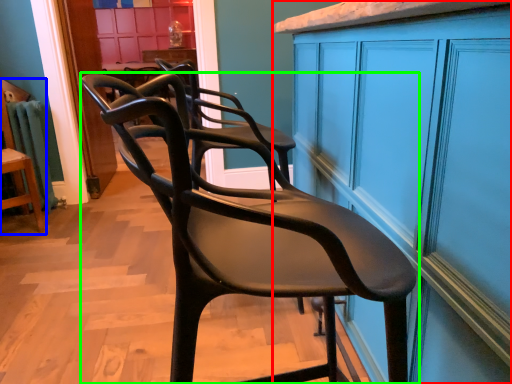
Question: Which is farther away from cabinetry (highlighted by a red box)? chair (highlighted by a blue box) or chair (highlighted by a green box)?

Choices:
 (A) chair
 (B) chair

Answer: (A)